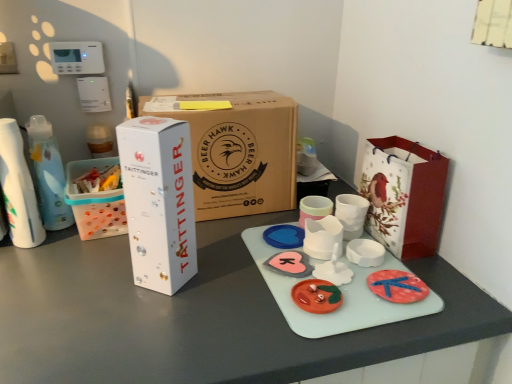
The width and height of the screenshot is (512, 384). I want to click on vacant position to the left of pink matte heart at center, arranged as the 2th toy when viewed from the back, so click(x=221, y=268).